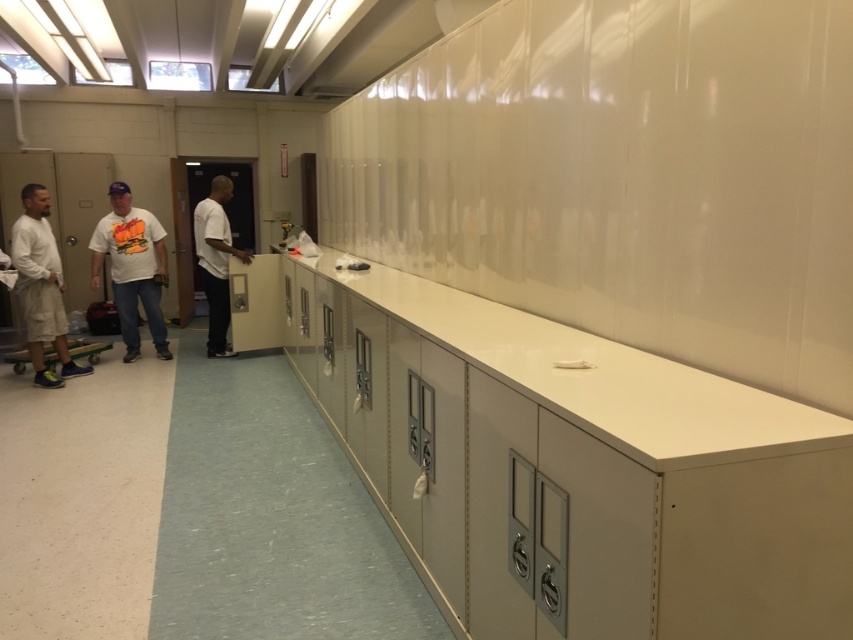
Question: Which object appears closest to the camera in this image?

Choices:
 (A) white matte t-shirt at center
 (B) matte khaki shorts at left
 (C) white matte shirt at center

Answer: (B)

Question: Among these points, which one is nearest to the camera?

Choices:
 (A) (39, 298)
 (B) (248, 262)
 (C) (86, 349)

Answer: (A)

Question: Is white matte t-shirt at center above matte khaki shorts at left?

Choices:
 (A) yes
 (B) no

Answer: (A)

Question: Estimate the real-world distances between objects in this image. Which object is farther from the white matte t-shirt at center?

Choices:
 (A) matte khaki shorts at left
 (B) white matte shirt at center

Answer: (A)

Question: Is white matte shirt at center below green rubber skateboard at lower left?

Choices:
 (A) no
 (B) yes

Answer: (A)

Question: Can you confirm if white matte t-shirt at center is positioned below white matte shirt at center?

Choices:
 (A) yes
 (B) no

Answer: (A)